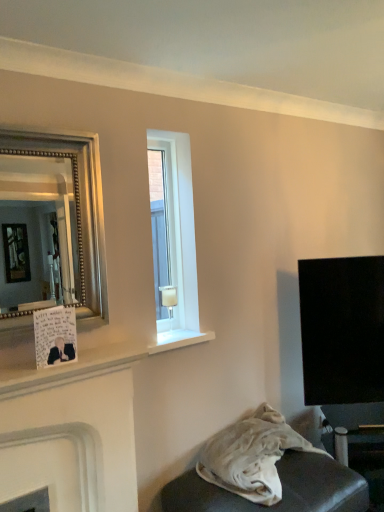
Image resolution: width=384 pixels, height=512 pixels. I want to click on empty space that is ontop of silver beaded mirror at left (from a real-world perspective), so click(43, 129).